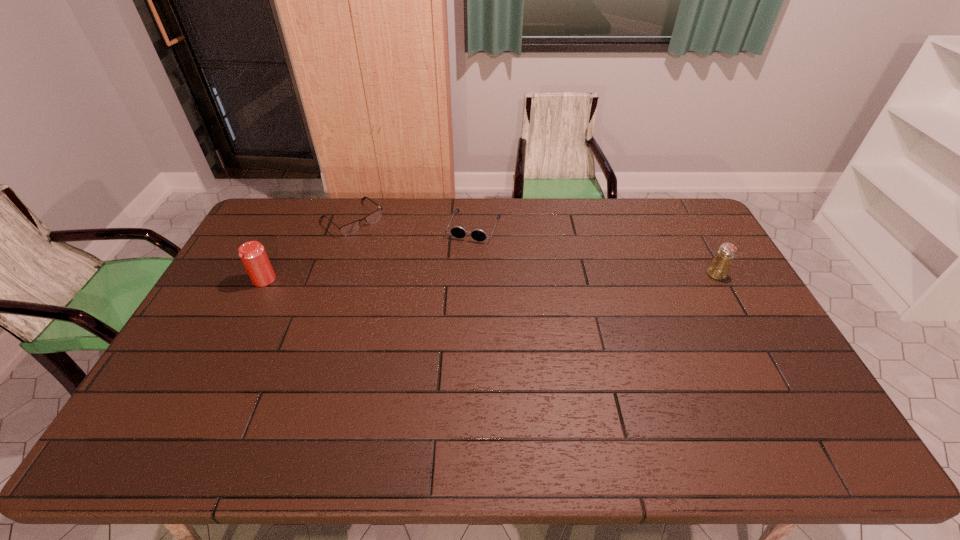
At what (x,y) coordinates should I click in order to perform the action: click on beer can. Please return your answer as a coordinate pair (x, y). The image size is (960, 540). Looking at the image, I should click on (253, 255).

Where is `saltshaker`? Image resolution: width=960 pixels, height=540 pixels. saltshaker is located at coordinates (718, 269).

I want to click on the third tallest object, so click(459, 232).

Image resolution: width=960 pixels, height=540 pixels. What are the coordinates of `sunglasses` in the screenshot? It's located at (459, 232).

Where is `spectacles`? Image resolution: width=960 pixels, height=540 pixels. spectacles is located at coordinates (350, 228).

You are a GUI agent. You are given a task and a screenshot of the screen. Output one action in this format:
    pyautogui.click(x=<x>, y=<y>)
    Task: Click on the shortest object
    The width and height of the screenshot is (960, 540).
    Given the screenshot: What is the action you would take?
    pyautogui.click(x=350, y=228)

The image size is (960, 540). I want to click on vacant space situated on the right of the beer can, so 325,279.

The height and width of the screenshot is (540, 960). I want to click on vacant area located on the back of the saltshaker, so click(684, 218).

You are a GUI agent. You are given a task and a screenshot of the screen. Output one action in this format:
    pyautogui.click(x=<x>, y=<y>)
    Task: Click on the free region located on the front-facing side of the sunglasses
    The height and width of the screenshot is (540, 960).
    Given the screenshot: What is the action you would take?
    pyautogui.click(x=463, y=256)

Identify the location of free region located on the front-facing side of the sunglasses. The image size is (960, 540). click(x=435, y=327).